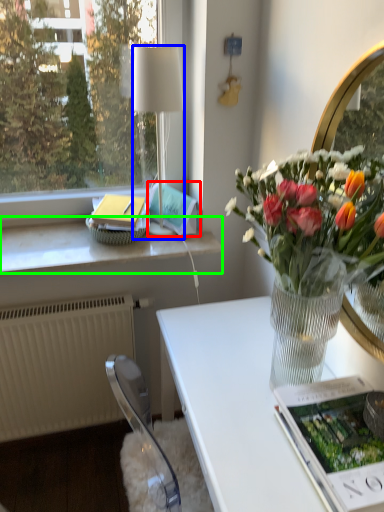
Question: Estimate the real-world distances between objects in this image. Which object is closer to magazine (highlighted by a red box), lamp (highlighted by a blue box) or window sill (highlighted by a green box)?

Choices:
 (A) lamp
 (B) window sill

Answer: (A)